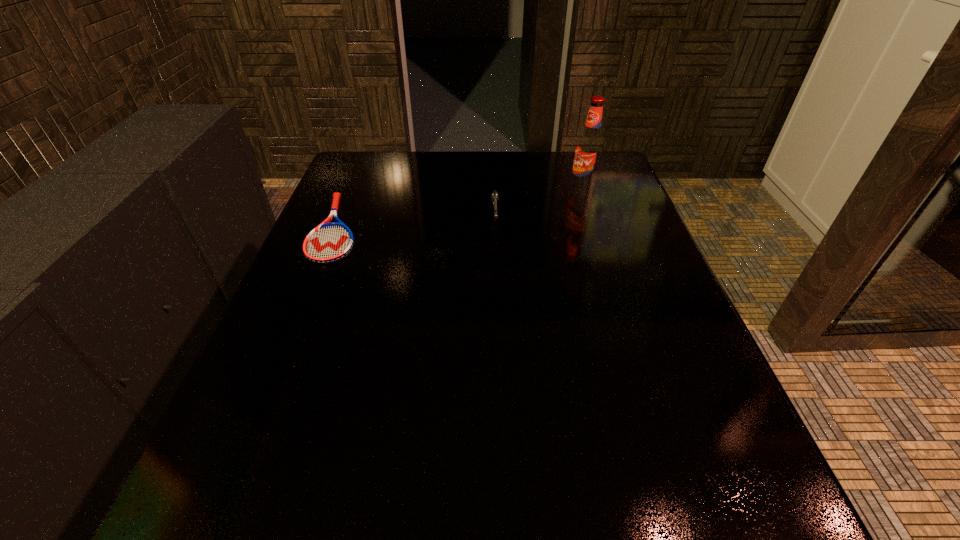
Locate an element on the screen. This screenshot has height=540, width=960. root beer is located at coordinates (589, 147).

Identify the location of the rightmost object. (589, 147).

Locate an element on the screen. This screenshot has height=540, width=960. pistol is located at coordinates (494, 195).

The image size is (960, 540). I want to click on the second object from right to left, so click(494, 195).

Find the location of a particular element. This screenshot has width=960, height=540. the leftmost object is located at coordinates (329, 242).

Find the location of a particular element. Image resolution: width=960 pixels, height=540 pixels. tennis racket is located at coordinates (329, 242).

Locate an element on the screen. This screenshot has width=960, height=540. vacant space located 0.250m on the left of the rightmost object is located at coordinates (471, 188).

This screenshot has height=540, width=960. In order to click on vacant area located 0.320m on the front-facing side of the second object from left to right in this screenshot , I will do `click(500, 348)`.

You are a GUI agent. You are given a task and a screenshot of the screen. Output one action in this format:
    pyautogui.click(x=<x>, y=<y>)
    Task: Click on the vacant region located on the right of the tennis racket
    
    Given the screenshot: What is the action you would take?
    (520, 228)

Identify the location of object present at the far edge. (589, 147).